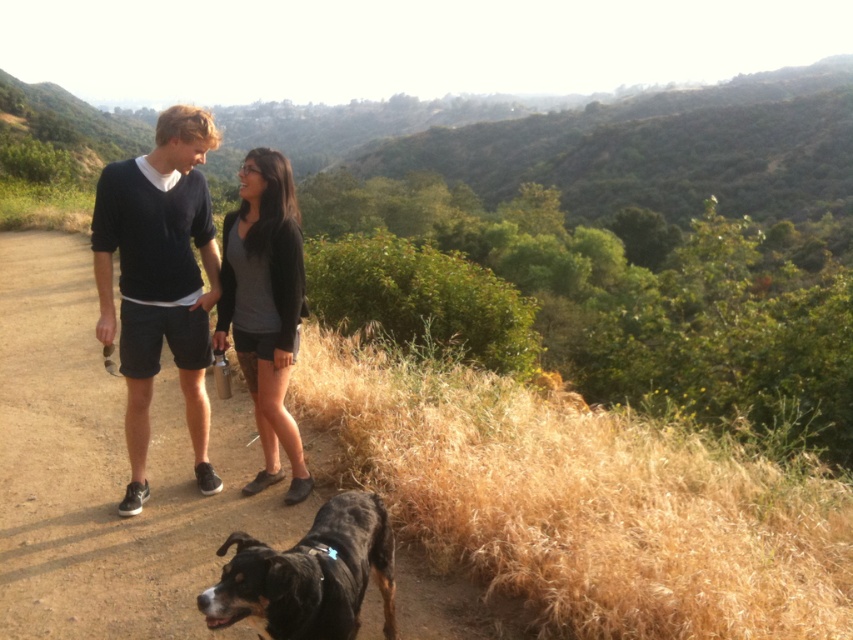
Question: Which point is closer to the camera?

Choices:
 (A) dirt path at center
 (B) black fur dog at lower left

Answer: (B)

Question: Does dirt path at center lie in front of black fur dog at lower left?

Choices:
 (A) no
 (B) yes

Answer: (A)

Question: Based on their relative distances, which object is farther from the gray matte/black shorts at center?

Choices:
 (A) dirt path at center
 (B) black cotton shorts at center

Answer: (A)

Question: Considering the real-world distances, which object is farthest from the dirt path at center?

Choices:
 (A) black fur dog at lower left
 (B) gray matte/black shorts at center

Answer: (B)

Question: Can you confirm if dirt path at center is positioned below black fur dog at lower left?

Choices:
 (A) no
 (B) yes

Answer: (A)

Question: From the image, what is the correct spatial relationship of dirt path at center in relation to black fur dog at lower left?

Choices:
 (A) below
 (B) above

Answer: (B)